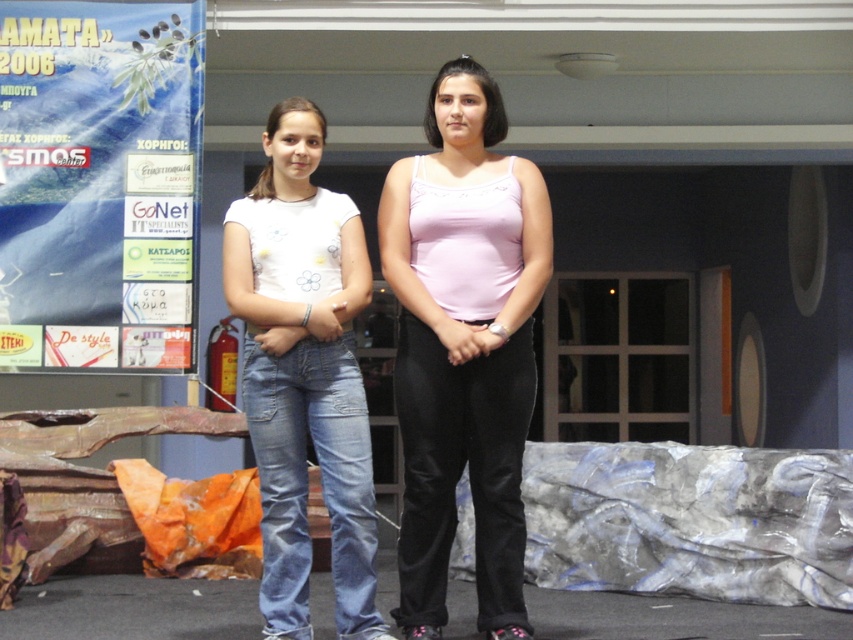
Can you confirm if pink fabric tank top at center is bigger than white denim jeans at left?

Yes.

Is point (500, 516) closer to viewer compared to point (270, 563)?

No, (500, 516) is further to viewer.

Locate an element on the screen. The width and height of the screenshot is (853, 640). pink fabric tank top at center is located at coordinates (463, 346).

How distant is blue paperboard poster at left from white denim jeans at left?

2.34 meters

Who is positioned more to the right, blue paperboard poster at left or white denim jeans at left?

Positioned to the right is white denim jeans at left.

Who is more distant from viewer, (169, 336) or (326, 472)?

The point (169, 336) is more distant.

This screenshot has height=640, width=853. Find the location of `blue paperboard poster at left`. blue paperboard poster at left is located at coordinates click(x=99, y=186).

What do you see at coordinates (99, 186) in the screenshot?
I see `blue paperboard poster at left` at bounding box center [99, 186].

Between blue paperboard poster at left and pink fabric tank top at center, which one has more height?

pink fabric tank top at center

Identify the location of blue paperboard poster at left. (99, 186).

At what (x,y) coordinates should I click in order to perform the action: click on blue paperboard poster at left. Please return your answer as a coordinate pair (x, y). Image resolution: width=853 pixels, height=640 pixels. Looking at the image, I should click on (99, 186).